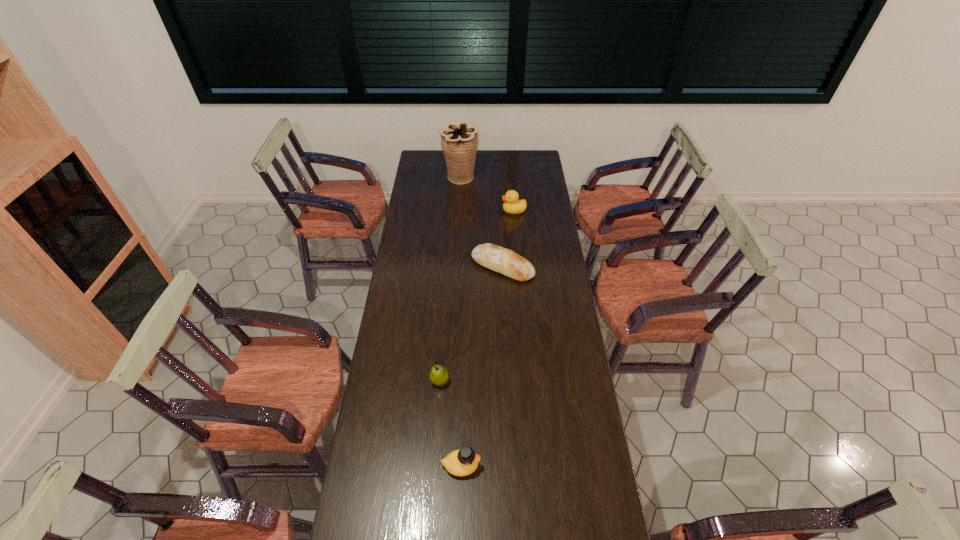
The image size is (960, 540). Find the location of `the tallest object`. the tallest object is located at coordinates (459, 141).

Where is `urn`? This screenshot has width=960, height=540. urn is located at coordinates (459, 141).

What are the coordinates of `the taller duck` in the screenshot? It's located at (512, 205).

Identify the location of the right duck. The height and width of the screenshot is (540, 960). (512, 205).

Where is `the left duck`? The height and width of the screenshot is (540, 960). the left duck is located at coordinates (462, 462).

The image size is (960, 540). Identify the location of the nearer duck. (462, 462).

Image resolution: width=960 pixels, height=540 pixels. I want to click on the second nearest object, so click(439, 375).

Image resolution: width=960 pixels, height=540 pixels. I want to click on the third nearest object, so click(496, 258).

In order to click on vacant space positioned 0.360m on the right of the farthest object in this screenshot , I will do `click(542, 178)`.

Where is `vacant region located 0.190m at the beak of the right duck`? This screenshot has height=540, width=960. vacant region located 0.190m at the beak of the right duck is located at coordinates (465, 211).